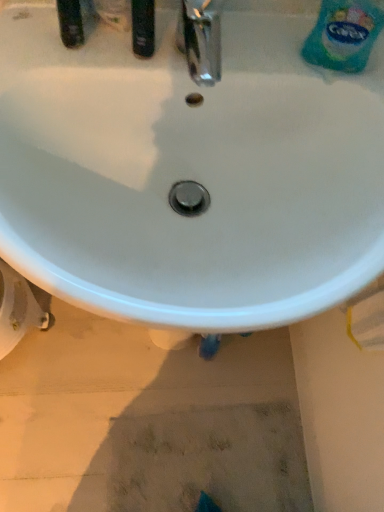
What do you see at coordinates (18, 309) in the screenshot? I see `white plastic bidet at lower left` at bounding box center [18, 309].

The height and width of the screenshot is (512, 384). I want to click on blue plastic bottle at upper right, so click(x=343, y=35).

Could you tell me if blue plastic bottle at upper right is facing white glossy sink at center?

No.

Is blue plastic bottle at upper right wider than white glossy sink at center?

In fact, blue plastic bottle at upper right might be narrower than white glossy sink at center.

In the scene shown: How much distance is there between blue plastic bottle at upper right and white glossy sink at center?

The distance of blue plastic bottle at upper right from white glossy sink at center is 9.78 inches.

From the image's perspective, is blue plastic bottle at upper right under white glossy sink at center?

No.

Based on the photo, is white glossy sink at center smaller than white plastic bidet at lower left?

Actually, white glossy sink at center might be larger than white plastic bidet at lower left.

Who is taller, white glossy sink at center or white plastic bidet at lower left?

Standing taller between the two is white glossy sink at center.

From a real-world perspective, which object rests below the other?

In real-world perspective, white plastic bidet at lower left is lower.

Which object is thinner, white plastic bidet at lower left or white glossy sink at center?

Thinner between the two is white plastic bidet at lower left.

Is white plastic bidet at lower left positioned far away from white glossy sink at center?

white plastic bidet at lower left is near white glossy sink at center, not far away.

Which is correct: white plastic bidet at lower left is inside white glossy sink at center, or outside of it?

white plastic bidet at lower left exists outside the volume of white glossy sink at center.

Where is `sink located above the white plastic bidet at lower left (from the image's perspective)`? The height and width of the screenshot is (512, 384). sink located above the white plastic bidet at lower left (from the image's perspective) is located at coordinates (190, 175).

Which of these two, white glossy sink at center or blue plastic bottle at upper right, stands taller?

Standing taller between the two is white glossy sink at center.

Is white glossy sink at center thinner than blue plastic bottle at upper right?

No, white glossy sink at center is not thinner than blue plastic bottle at upper right.

Can we say white glossy sink at center lies outside blue plastic bottle at upper right?

Indeed, white glossy sink at center is completely outside blue plastic bottle at upper right.

Could you tell me if blue plastic bottle at upper right is facing white plastic bidet at lower left?

No.

Considering the sizes of objects blue plastic bottle at upper right and white plastic bidet at lower left in the image provided, who is taller, blue plastic bottle at upper right or white plastic bidet at lower left?

white plastic bidet at lower left is taller.

Are blue plastic bottle at upper right and white plastic bidet at lower left located far from each other?

blue plastic bottle at upper right is near white plastic bidet at lower left, not far away.

Is white plastic bidet at lower left outside of blue plastic bottle at upper right?

white plastic bidet at lower left lies outside blue plastic bottle at upper right's area.

Visually, is white plastic bidet at lower left positioned to the left or to the right of blue plastic bottle at upper right?

Based on their positions, white plastic bidet at lower left is located to the left of blue plastic bottle at upper right.

Which is less distant, (11, 320) or (357, 35)?

Point (11, 320) is farther from the camera than point (357, 35).

How different are the orientations of white plastic bidet at lower left and blue plastic bottle at upper right in degrees?

11.1 degrees separate the facing orientations of white plastic bidet at lower left and blue plastic bottle at upper right.

Where is `sink located on the left of blue plastic bottle at upper right`? The width and height of the screenshot is (384, 512). sink located on the left of blue plastic bottle at upper right is located at coordinates (190, 175).

Find the location of a particular element. bidet below the white glossy sink at center (from a real-world perspective) is located at coordinates (x=18, y=309).

Estimate the real-world distances between objects in this image. Which object is closer to white glossy sink at center, blue plastic bottle at upper right or white plastic bidet at lower left?

blue plastic bottle at upper right lies closer to white glossy sink at center than the other object.

Considering their positions, is white plastic bidet at lower left positioned further to white glossy sink at center than blue plastic bottle at upper right?

white plastic bidet at lower left lies further to white glossy sink at center than the other object.

Considering their positions, is white glossy sink at center positioned further to blue plastic bottle at upper right than white plastic bidet at lower left?

white plastic bidet at lower left lies further to blue plastic bottle at upper right than the other object.

From the picture: From the image, which object appears to be farther from white plastic bidet at lower left, blue plastic bottle at upper right or white glossy sink at center?

blue plastic bottle at upper right lies further to white plastic bidet at lower left than the other object.

Based on their spatial positions, is white plastic bidet at lower left or white glossy sink at center closer to blue plastic bottle at upper right?

The object closer to blue plastic bottle at upper right is white glossy sink at center.

Which object lies further to the anchor point white plastic bidet at lower left, white glossy sink at center or blue plastic bottle at upper right?

blue plastic bottle at upper right is positioned further to the anchor white plastic bidet at lower left.

Where is `sink between white plastic bidet at lower left and blue plastic bottle at upper right in the horizontal direction`? This screenshot has height=512, width=384. sink between white plastic bidet at lower left and blue plastic bottle at upper right in the horizontal direction is located at coordinates (190, 175).